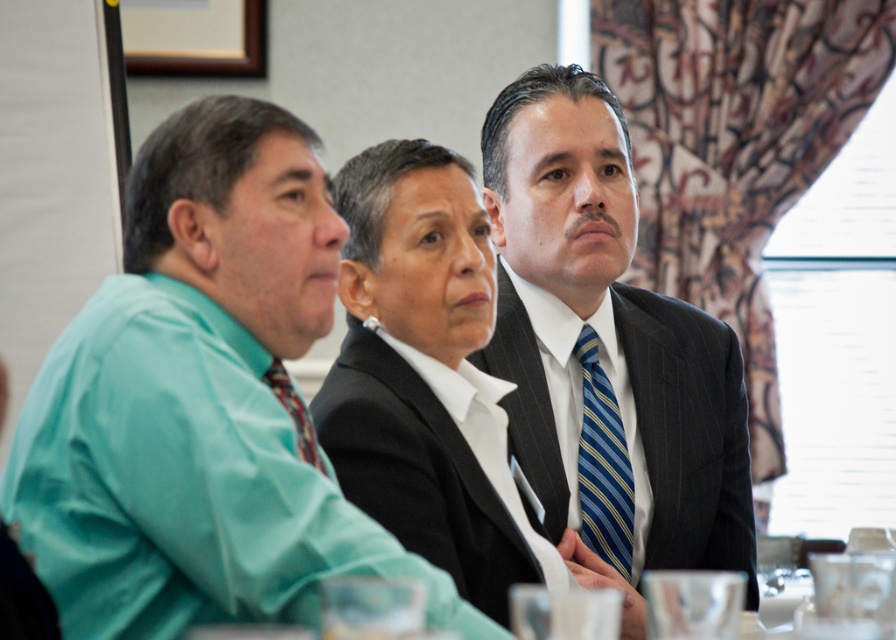
Question: Does dark gray pinstripe suit at center have a larger size compared to striped silk tie at left?

Choices:
 (A) yes
 (B) no

Answer: (A)

Question: Which point is farther from the camera taking this photo?

Choices:
 (A) (705, 516)
 (B) (190, 556)

Answer: (A)

Question: Can you confirm if teal fabric shirt at left is smaller than blue striped tie at center?

Choices:
 (A) no
 (B) yes

Answer: (A)

Question: Which of the following is the closest to the observer?

Choices:
 (A) (474, 273)
 (B) (125, 442)
 (C) (297, 424)
 (D) (612, 406)

Answer: (B)

Question: Which point is closer to the camera?

Choices:
 (A) [498, 452]
 (B) [300, 426]

Answer: (B)

Question: Is blue striped tie at center thinner than striped silk tie at left?

Choices:
 (A) yes
 (B) no

Answer: (B)